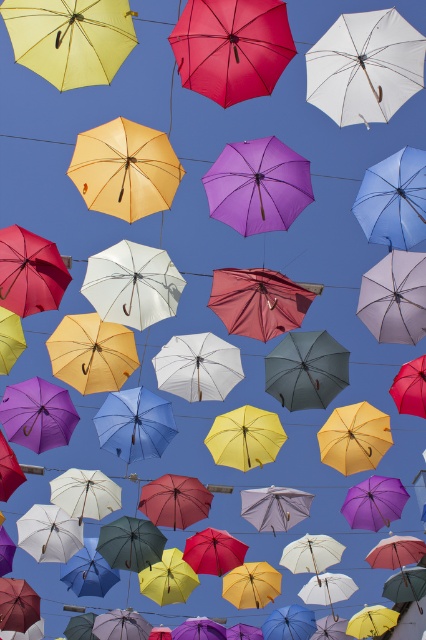
Question: Can you confirm if matte red umbrella at center is smaller than matte yellow umbrella at center?

Choices:
 (A) no
 (B) yes

Answer: (B)

Question: Which of the following is the farthest from the observer?

Choices:
 (A) coord(163,170)
 (B) coord(224,99)
 (C) coord(278,179)

Answer: (C)

Question: Which point is farther to the camera?

Choices:
 (A) matte yellow umbrella at center
 (B) matte red umbrella at center
 (C) purple matte umbrella at center

Answer: (C)

Question: Does matte red umbrella at center appear under matte yellow umbrella at center?

Choices:
 (A) no
 (B) yes

Answer: (A)

Question: Which point is farther to the camera?

Choices:
 (A) (275, 22)
 (B) (210, 180)

Answer: (B)

Question: Can you confirm if matte yellow umbrella at center is positioned below purple matte umbrella at center?

Choices:
 (A) yes
 (B) no

Answer: (B)